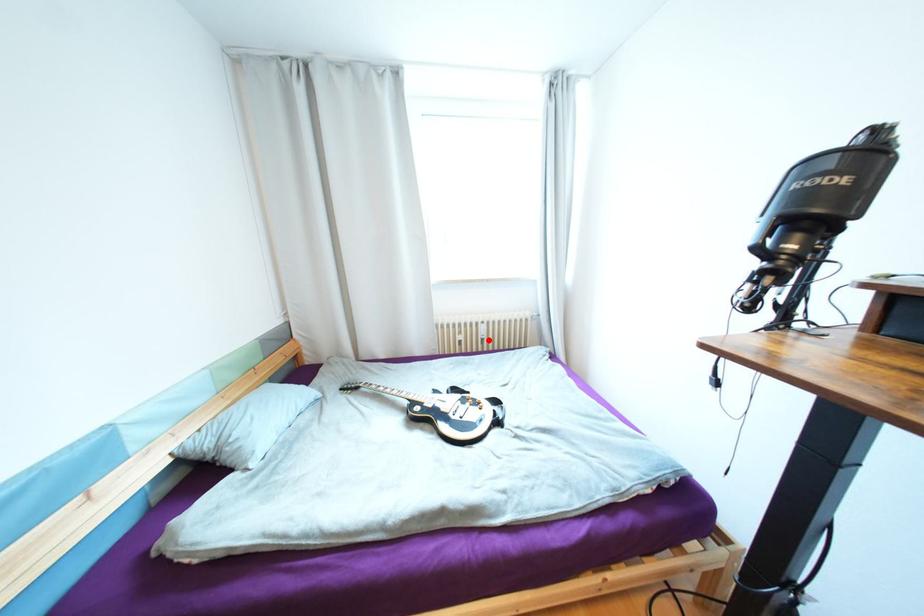
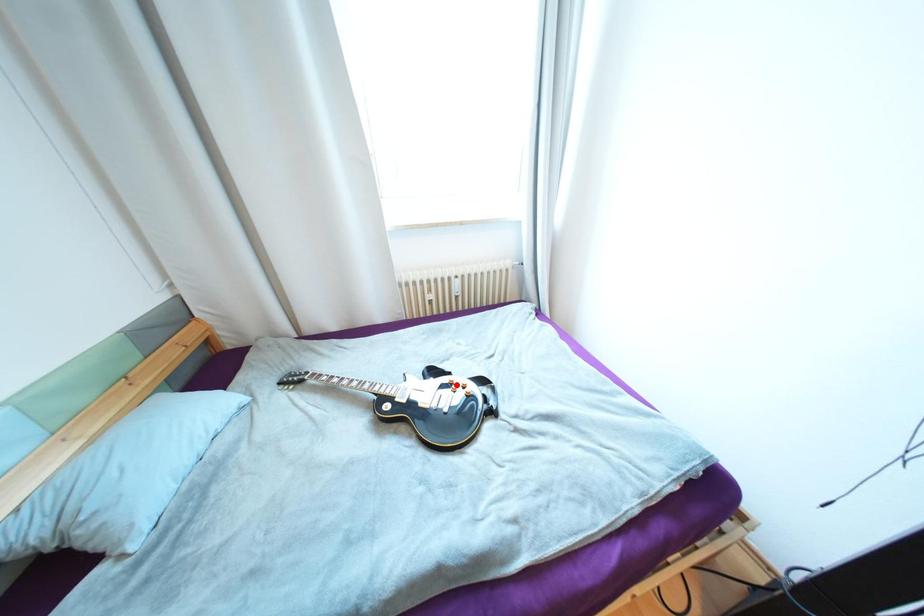
I am providing you with two images of the same scene from different viewpoints. A red point is marked on the first image and another point is marked on the second image. Are the points marked in image1 and image2 representing the same 3D position?

No